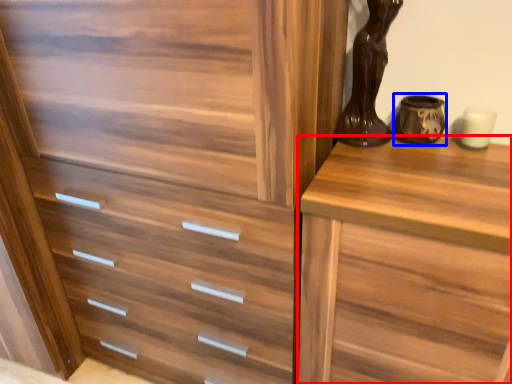
Question: Which object appears closest to the camera in this image, chest of drawers (highlighted by a red box) or vase (highlighted by a blue box)?

Choices:
 (A) chest of drawers
 (B) vase

Answer: (A)